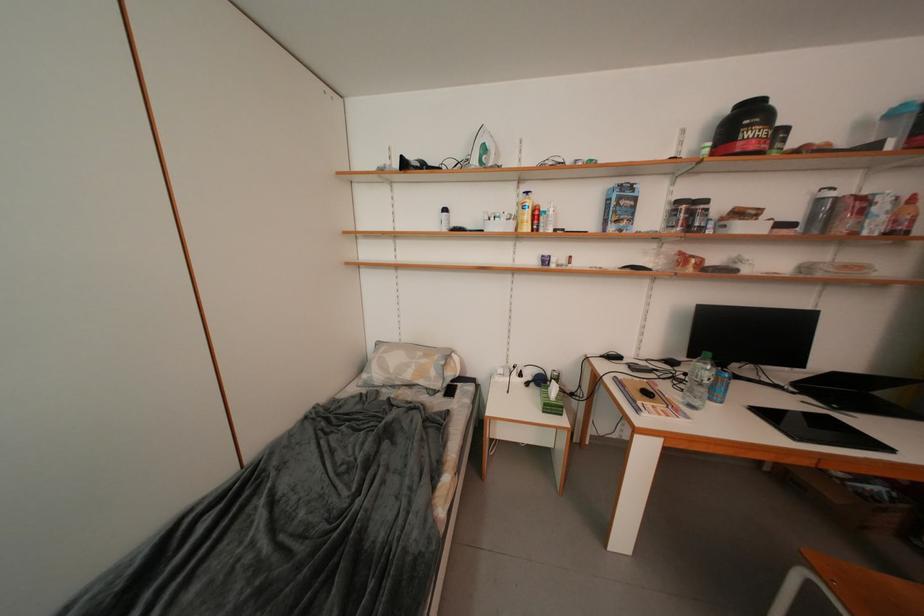
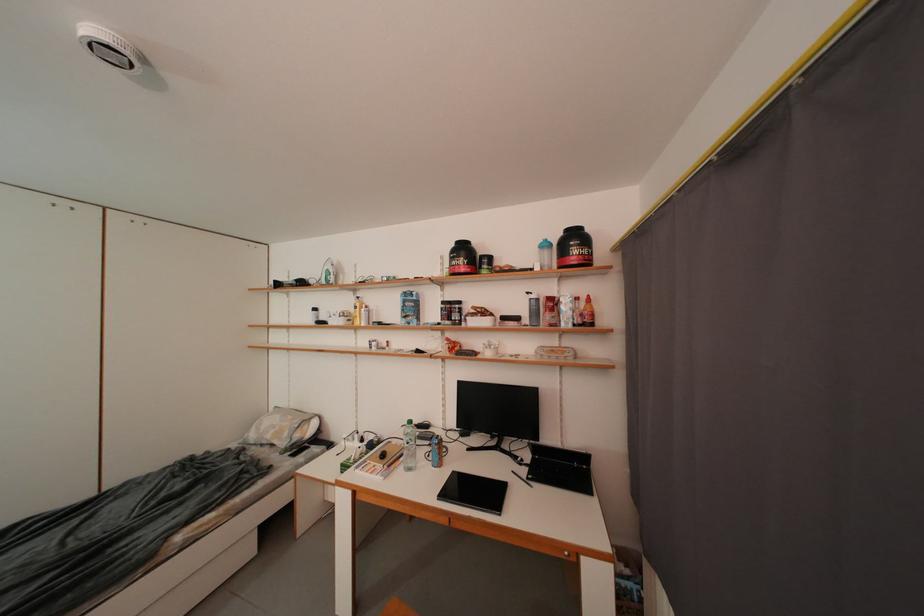
Where in the second image is the point corresponding to [441,376] from the first image?

(294, 438)